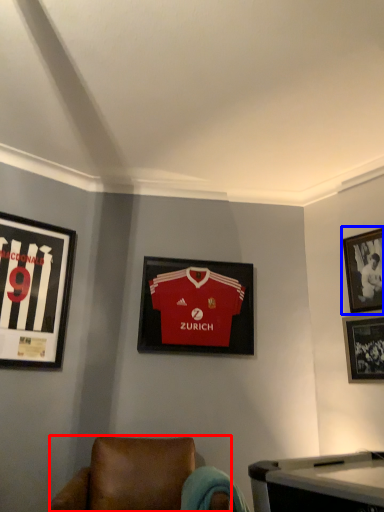
Question: Which object is further to the camera taking this photo, chair (highlighted by a red box) or picture frame (highlighted by a blue box)?

Choices:
 (A) chair
 (B) picture frame

Answer: (B)